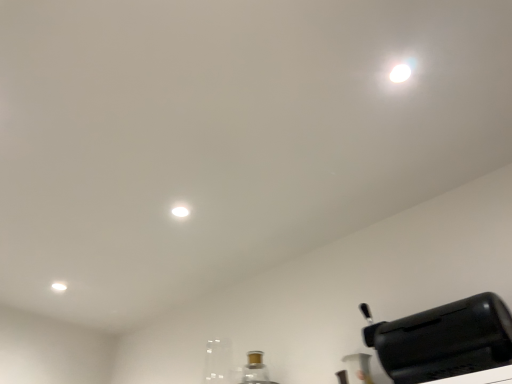
In the scene shown: In order to face black plastic toaster at lower right, should I rotate leftwards or rightwards?

It's best to rotate right around 22.078 degrees.

Find the location of a particular element. The height and width of the screenshot is (384, 512). black plastic toaster at lower right is located at coordinates (444, 340).

Describe the element at coordinates (444, 340) in the screenshot. I see `black plastic toaster at lower right` at that location.

This screenshot has height=384, width=512. What do you see at coordinates (59, 286) in the screenshot? I see `matte white light at upper left` at bounding box center [59, 286].

The image size is (512, 384). What are the coordinates of `matte white light at upper left` in the screenshot? It's located at (59, 286).

Locate an element on the screen. This screenshot has width=512, height=384. black plastic toaster at lower right is located at coordinates click(444, 340).

Which is more to the left, black plastic toaster at lower right or matte white light at upper left?

matte white light at upper left.

Does black plastic toaster at lower right lie behind matte white light at upper left?

No, black plastic toaster at lower right is closer to the viewer.

Which is closer to the camera, (467, 369) or (58, 283)?

The point (467, 369) is closer to the camera.

From the image's perspective, would you say black plastic toaster at lower right is positioned over matte white light at upper left?

Indeed, from the image's perspective, black plastic toaster at lower right is shown above matte white light at upper left.

From a real-world perspective, is black plastic toaster at lower right above or below matte white light at upper left?

black plastic toaster at lower right is below matte white light at upper left.

Can you confirm if black plastic toaster at lower right is thinner than matte white light at upper left?

Incorrect, the width of black plastic toaster at lower right is not less than that of matte white light at upper left.

Consider the image. Who is shorter, black plastic toaster at lower right or matte white light at upper left?

Standing shorter between the two is matte white light at upper left.

Considering the relative sizes of black plastic toaster at lower right and matte white light at upper left in the image provided, is black plastic toaster at lower right smaller than matte white light at upper left?

No, black plastic toaster at lower right is not smaller than matte white light at upper left.

Consider the image. Is black plastic toaster at lower right positioned beyond the bounds of matte white light at upper left?

Indeed, black plastic toaster at lower right is completely outside matte white light at upper left.

Is black plastic toaster at lower right positioned far away from matte white light at upper left?

black plastic toaster at lower right is far away from matte white light at upper left.

Is black plastic toaster at lower right oriented towards matte white light at upper left?

No, black plastic toaster at lower right is not oriented towards matte white light at upper left.

Locate an element on the screen. The image size is (512, 384). home appliance below the matte white light at upper left (from a real-world perspective) is located at coordinates (444, 340).

Which is more to the left, matte white light at upper left or black plastic toaster at lower right?

matte white light at upper left.

Does matte white light at upper left lie behind black plastic toaster at lower right?

Yes, the depth of matte white light at upper left is greater than that of black plastic toaster at lower right.

Between point (58, 286) and point (469, 372), which one is positioned behind?

Point (58, 286)

From the image's perspective, does matte white light at upper left appear higher than black plastic toaster at lower right?

No, from the image's perspective, matte white light at upper left is not on top of black plastic toaster at lower right.

From a real-world perspective, is matte white light at upper left positioned under black plastic toaster at lower right based on gravity?

Incorrect, from a real-world perspective, matte white light at upper left is higher than black plastic toaster at lower right.

Which object is thinner, matte white light at upper left or black plastic toaster at lower right?

Thinner between the two is matte white light at upper left.

Considering the sizes of objects matte white light at upper left and black plastic toaster at lower right in the image provided, who is shorter, matte white light at upper left or black plastic toaster at lower right?

matte white light at upper left.

In the scene shown: Based on their sizes in the image, would you say matte white light at upper left is bigger or smaller than black plastic toaster at lower right?

matte white light at upper left is smaller than black plastic toaster at lower right.

Could black plastic toaster at lower right be considered to be inside matte white light at upper left?

No, black plastic toaster at lower right is not surrounded by matte white light at upper left.

Would you say matte white light at upper left is a long distance from black plastic toaster at lower right?

matte white light at upper left is positioned a significant distance from black plastic toaster at lower right.

Is matte white light at upper left oriented towards black plastic toaster at lower right?

No, matte white light at upper left is not turned towards black plastic toaster at lower right.

Can you tell me how much matte white light at upper left and black plastic toaster at lower right differ in facing direction?

They differ by 0.0036 degrees in their facing directions.

The height and width of the screenshot is (384, 512). Identify the location of dot behind the black plastic toaster at lower right. (59, 286).

Where is `home appliance in front of the matte white light at upper left`? home appliance in front of the matte white light at upper left is located at coordinates (444, 340).

This screenshot has height=384, width=512. I want to click on dot behind the black plastic toaster at lower right, so click(59, 286).